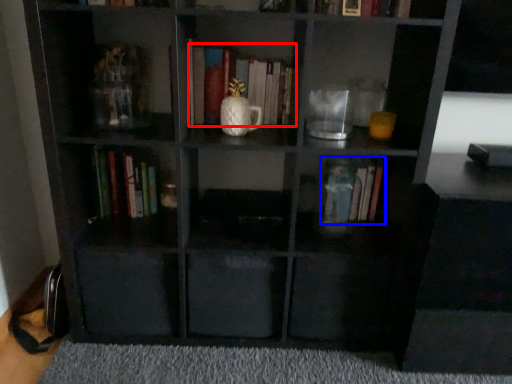
Question: Which object appears closest to the camera in this image, book (highlighted by a red box) or book (highlighted by a blue box)?

Choices:
 (A) book
 (B) book

Answer: (A)